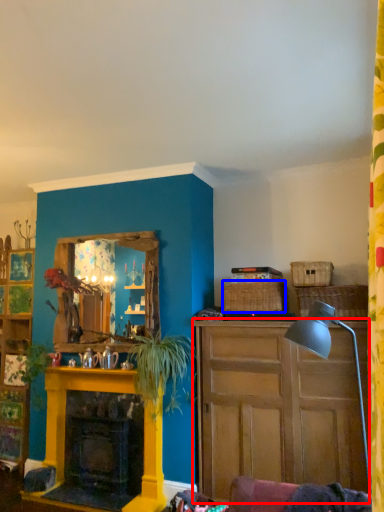
Question: Which object is closer to the camera taking this photo, cabinet (highlighted by a red box) or picnic basket (highlighted by a blue box)?

Choices:
 (A) cabinet
 (B) picnic basket

Answer: (A)